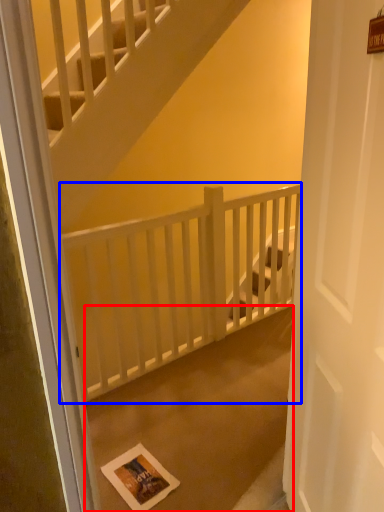
Question: Among these objects, which one is nearest to the camera, concrete (highlighted by a red box) or balustrade (highlighted by a blue box)?

Choices:
 (A) concrete
 (B) balustrade

Answer: (A)